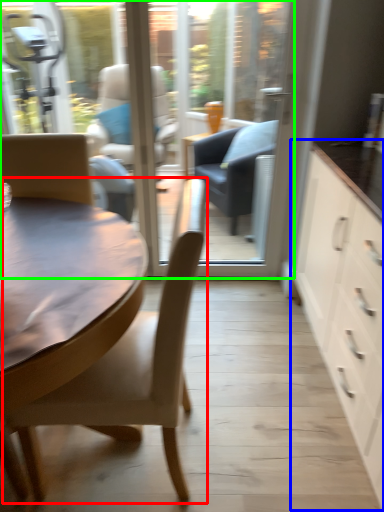
Question: Which is farther away from chair (highlighted by a red box)? cabinetry (highlighted by a blue box) or window screen (highlighted by a green box)?

Choices:
 (A) cabinetry
 (B) window screen

Answer: (B)